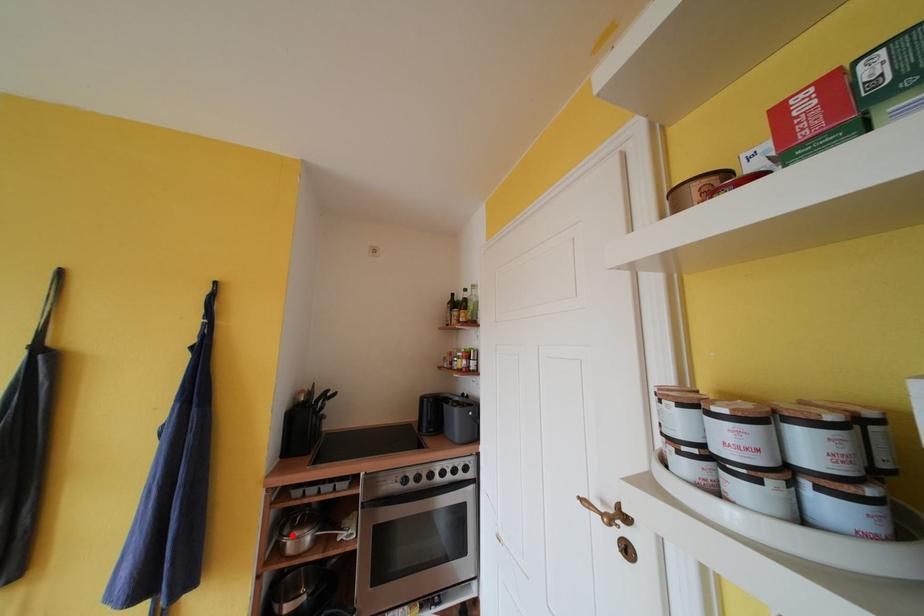
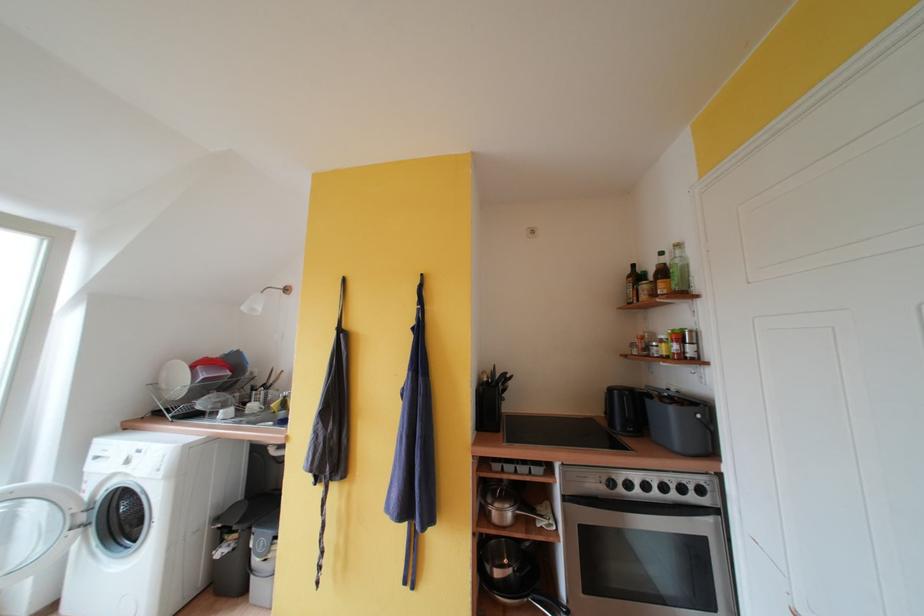
In the second image, find the point that corresponds to the highlighted location in the first image.

(495, 504)